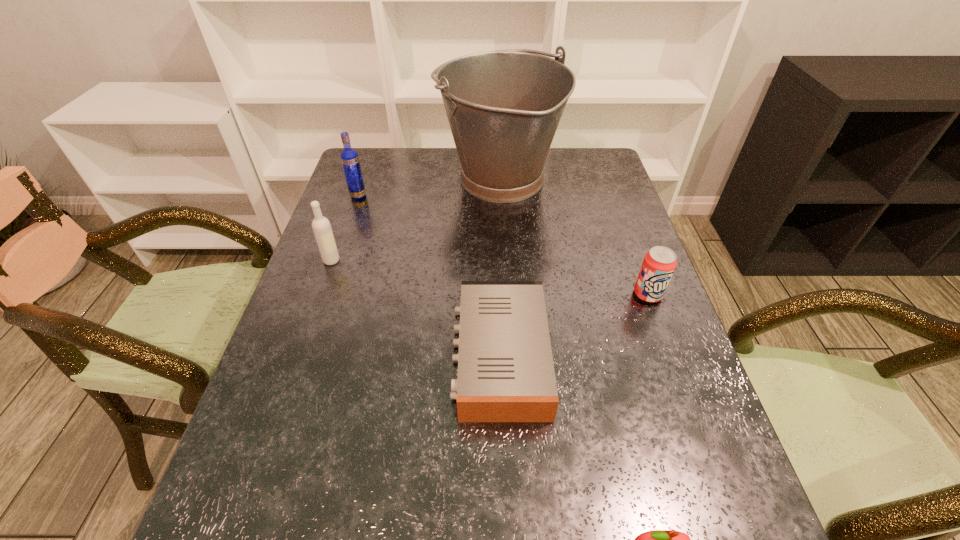
This screenshot has height=540, width=960. Identify the location of free space located on the control panel of the shortest object. (416, 356).

The width and height of the screenshot is (960, 540). In order to click on free location located on the control panel of the shortest object in this screenshot , I will do `click(411, 356)`.

This screenshot has width=960, height=540. I want to click on vacant area situated on the control panel of the shortest object, so click(411, 356).

Find the location of `object that is at the far edge`. object that is at the far edge is located at coordinates (503, 107).

Locate an element on the screen. object situated at the right edge is located at coordinates (658, 266).

You are a GUI agent. You are given a task and a screenshot of the screen. Output one action in this format:
    pyautogui.click(x=<x>, y=<y>)
    Task: Click on the free space at the left edge of the desktop
    The height and width of the screenshot is (540, 960).
    Given the screenshot: What is the action you would take?
    pyautogui.click(x=320, y=446)

I want to click on free space at the right edge of the desktop, so click(653, 328).

What are the coordinates of `free spot at the far right corner of the desktop` in the screenshot? It's located at (586, 168).

Where is `free spot between the nearer vodka and the radio receiver`? free spot between the nearer vodka and the radio receiver is located at coordinates (416, 308).

The width and height of the screenshot is (960, 540). In order to click on free area in between the shortest object and the farther vodka in this screenshot , I will do `click(429, 276)`.